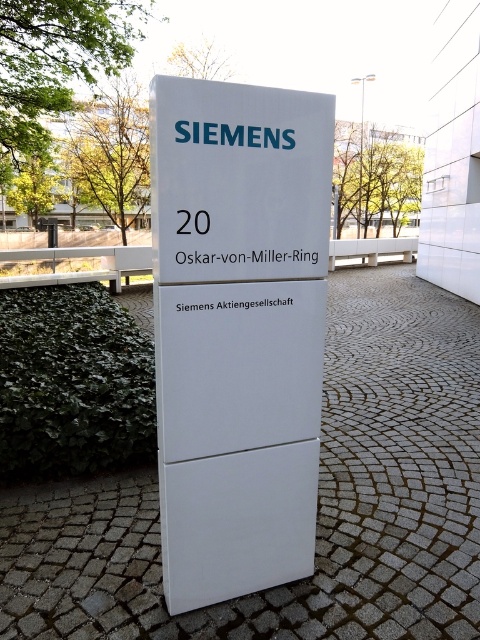
You are standing at the origin point of a coordinate system placed over the image. The origin is at the bottom left corner of the image. The x and y axes increase to the right and upwards respectively. You need to determine the direction to walk to reach the white matte sign at center. Which direction should you go? Please answer with a direction like North, South, East, West, Northeast, etc., or a coordinate direction like positive x, negative y, etc.

The white matte sign at center is located at coordinates approximately 0.517 on the x axis and 0.496 on the y axis. Since the origin is at the bottom left, moving towards positive x is East and positive y is North. Therefore, the sign is slightly to the East and North of the origin, so the direction to walk is Northeast.

You are a delivery driver who needs to read the address on the sign. You see the white matte sign at center and the white plastic sign at center. Which one is taller?

The white matte sign at center is much taller than the white plastic sign at center, so the white matte sign at center is the taller one.

From the picture: You are a delivery person trying to read the address on the white matte sign at center and the white plastic sign at center. Which one do you need to look closer at to read the details?

The white plastic sign at center is smaller than the white matte sign at center, so you need to look closer at the white plastic sign at center to read the details.